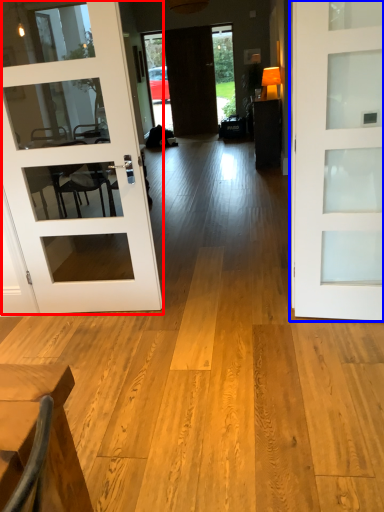
Question: Which object appears closest to the camera in this image, door (highlighted by a red box) or door (highlighted by a blue box)?

Choices:
 (A) door
 (B) door

Answer: (B)